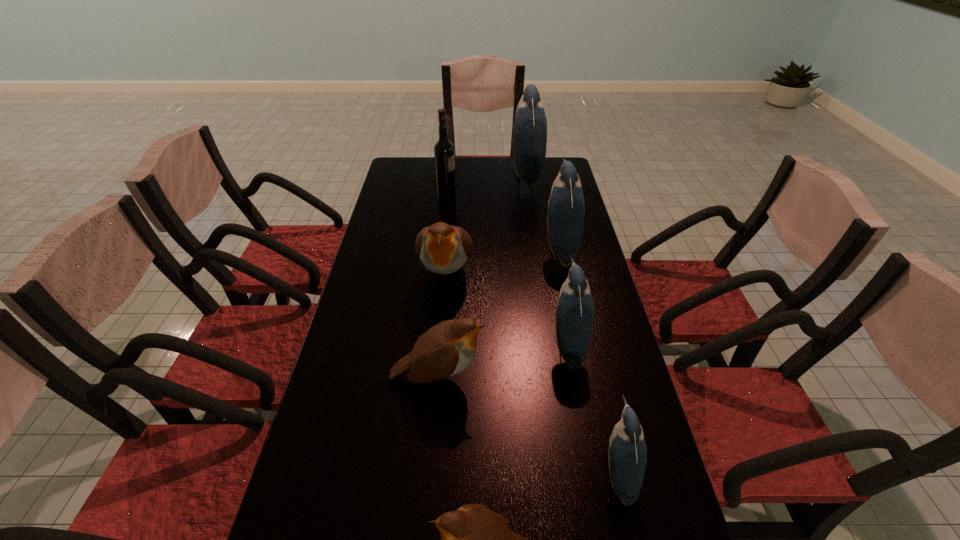
Identify the location of free space located 0.270m at the tip of the farthest bird's beak. This screenshot has width=960, height=540. (445, 178).

I want to click on vacant space situated at the tip of the farthest bird's beak, so click(431, 178).

This screenshot has width=960, height=540. In order to click on free point located 0.080m at the tip of the farthest bird's beak in this screenshot , I will do `click(492, 178)`.

At what (x,y) coordinates should I click in order to perform the action: click on free spot located 0.240m on the front and back of the wine bottle. Please return your answer as a coordinate pair (x, y). This screenshot has width=960, height=540. Looking at the image, I should click on (517, 197).

Where is `vacant region located 0.390m at the tip of the sixth shortest bird's beak`? Image resolution: width=960 pixels, height=540 pixels. vacant region located 0.390m at the tip of the sixth shortest bird's beak is located at coordinates (426, 250).

This screenshot has width=960, height=540. I want to click on vacant space situated 0.290m at the tip of the sixth shortest bird's beak, so click(x=456, y=250).

The image size is (960, 540). Find the location of `free space located 0.270m at the tip of the sixth shortest bird's beak`. free space located 0.270m at the tip of the sixth shortest bird's beak is located at coordinates click(462, 250).

Where is `vacant area situated 0.320m at the face of the farthest brown bird`? vacant area situated 0.320m at the face of the farthest brown bird is located at coordinates (435, 410).

Identify the location of free location located at the tip of the second nearest blue bird's beak. (404, 344).

At what (x,y) coordinates should I click in order to perform the action: click on vacant space positioned at the tip of the second nearest blue bird's beak. Please return your answer as a coordinate pair (x, y). The height and width of the screenshot is (540, 960). Looking at the image, I should click on (491, 344).